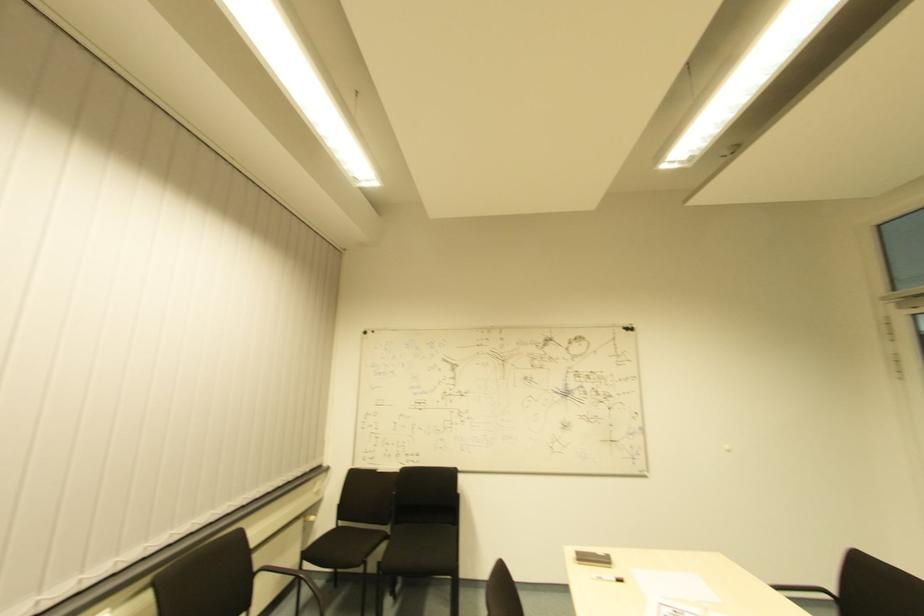
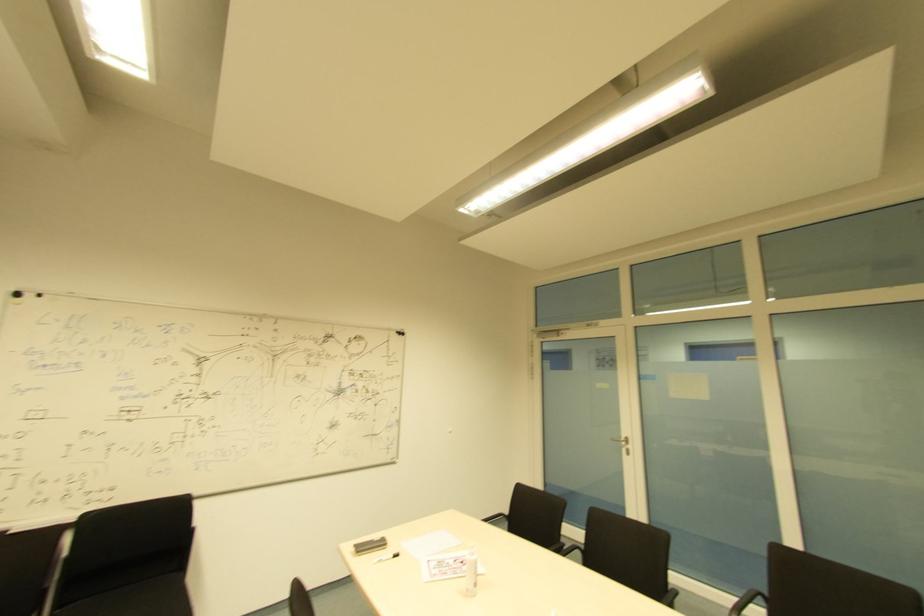
In the second image, find the point that corresponds to (618,582) in the first image.

(394, 554)